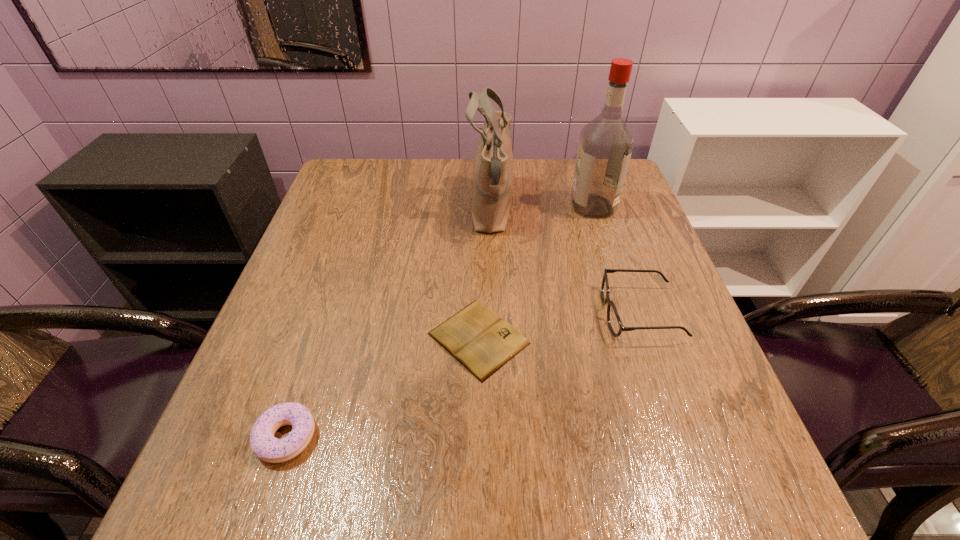
Where is `liquor`? The image size is (960, 540). liquor is located at coordinates (605, 146).

Image resolution: width=960 pixels, height=540 pixels. What are the coordinates of `shoulder bag` in the screenshot? It's located at (493, 170).

The width and height of the screenshot is (960, 540). I want to click on the third shortest object, so click(x=616, y=327).

Where is `doughnut`? doughnut is located at coordinates point(266,447).

Find the location of `the leftmost object`. the leftmost object is located at coordinates (266, 447).

You are a GUI agent. You are given a task and a screenshot of the screen. Output one action in this format:
    pyautogui.click(x=<x>, y=<y>)
    Task: Click on the book
    This screenshot has width=960, height=540.
    Given the screenshot: What is the action you would take?
    pyautogui.click(x=476, y=336)

At what (x,y) coordinates should I click in order to perform the action: click on blank space located 0.190m on the front-facing side of the liquor. Please return your answer as a coordinate pair (x, y). The height and width of the screenshot is (540, 960). Looking at the image, I should click on (502, 207).

This screenshot has height=540, width=960. I want to click on vacant point located 0.400m on the front-facing side of the liquor, so click(426, 207).

You are a GUI agent. You are given a task and a screenshot of the screen. Output one action in this format:
    pyautogui.click(x=<x>, y=<y>)
    Task: Click on the vacant space located on the front-facing side of the liquor
    Image resolution: width=960 pixels, height=540 pixels.
    Given the screenshot: What is the action you would take?
    pyautogui.click(x=539, y=207)

The width and height of the screenshot is (960, 540). I want to click on free point located 0.390m on the front-facing side of the fourth shortest object, so click(325, 210).